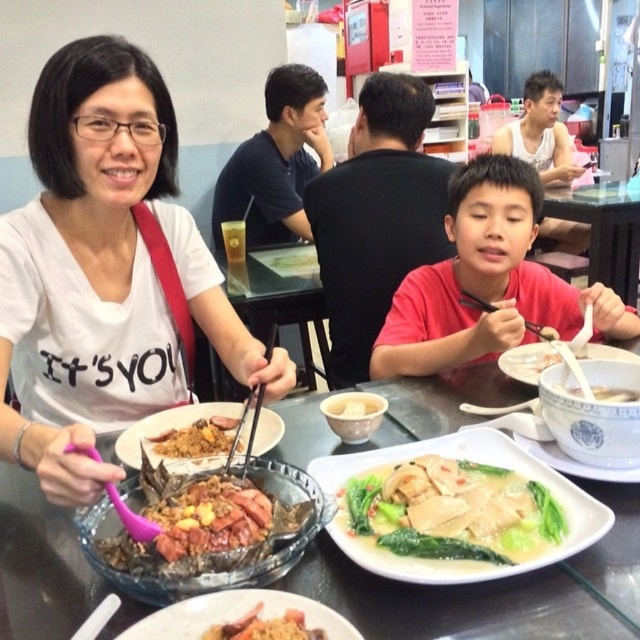
Can you confirm if white ceramic bowl at center is positioned above black plastic chopstick at right?

Actually, white ceramic bowl at center is below black plastic chopstick at right.

Does white ceramic bowl at center appear on the left side of black plastic chopstick at right?

Yes, white ceramic bowl at center is to the left of black plastic chopstick at right.

Is point (604, 372) more distant than point (547, 333)?

No, it is not.

You are a GUI agent. You are given a task and a screenshot of the screen. Output one action in this format:
    pyautogui.click(x=<x>, y=<y>)
    Task: Click on the white ceramic bowl at center
    The image size is (640, 640).
    Given the screenshot: What is the action you would take?
    pyautogui.click(x=588, y=422)

Is white creamy soup with tofu and vegetables at center wider than black plastic chopstick at right?

Correct, the width of white creamy soup with tofu and vegetables at center exceeds that of black plastic chopstick at right.

Does point (451, 461) lie in front of point (529, 324)?

Yes, it is in front of point (529, 324).

Measure the distance between white creamy soup with tofu and vegetables at center and camera.

They are 26.35 inches apart.

You are a GUI agent. You are given a task and a screenshot of the screen. Output one action in this format:
    pyautogui.click(x=<x>, y=<y>)
    Task: Click on the white creamy soup with tofu and vegetables at center
    The width and height of the screenshot is (640, 640).
    Given the screenshot: What is the action you would take?
    pyautogui.click(x=452, y=509)

Consider the image. Can you confirm if red matte shirt at center is wider than transparent plastic table at center?

Yes.

Is red matte shirt at center taller than transparent plastic table at center?

Incorrect, red matte shirt at center's height is not larger of transparent plastic table at center's.

Locate an element on the screen. The width and height of the screenshot is (640, 640). red matte shirt at center is located at coordinates (486, 282).